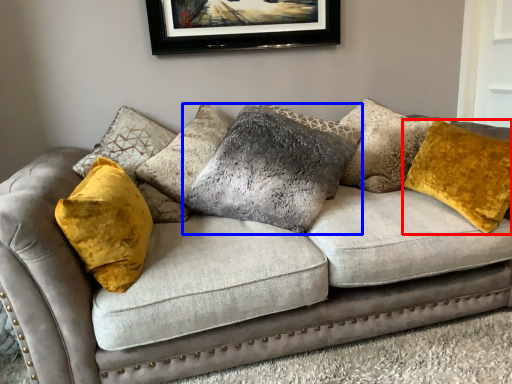
Question: Which of the following is the closest to the observer, pillow (highlighted by a red box) or pillow (highlighted by a blue box)?

Choices:
 (A) pillow
 (B) pillow

Answer: (A)